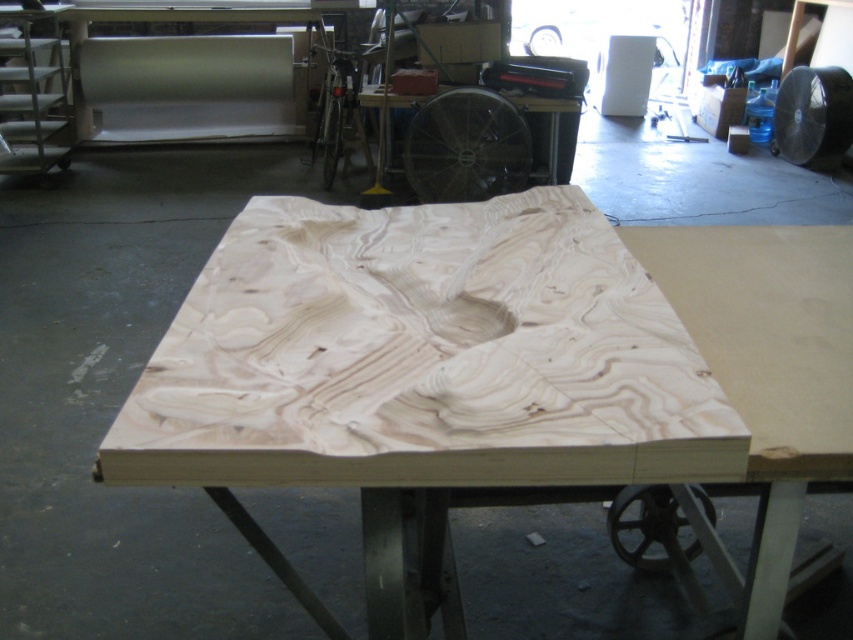
You are organizing tools in a workshop. You need to place a new tool on the natural wood table at center. Where should you place it so it doesn not interfere with the natural wood plywood at center?

The natural wood plywood at center is to the left of the natural wood table at center. To avoid interference, place the tool to the right side of the natural wood table at center.

You are standing in the workshop and want to reach the point marked at coordinates point (560, 212). If your arm can extend 3 feet, can you reach it without moving?

The point (560, 212) is 5.36 feet away from the camera, so no, you cannot reach it with an arm extension of 3 feet since it is farther away.

In the scene shown: You are a carpenter who needs to move a 10 feet long wooden plank from the natural wood table at center to the natural wood plywood at center. Can you safely move it without bending the plank?

The natural wood plywood at center is 11.35 feet away from the natural wood table at center. Since the plank is 10 feet long, it can be moved safely as the distance between them allows enough space without needing to bend the plank.